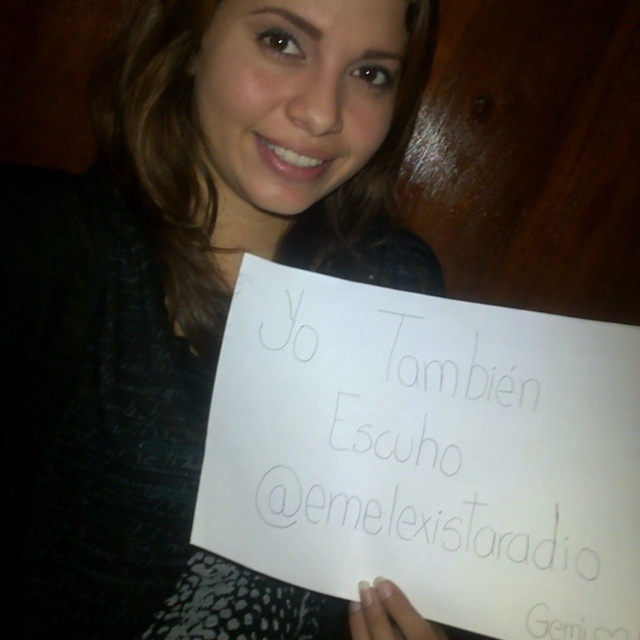
Image resolution: width=640 pixels, height=640 pixels. What do you see at coordinates (188, 301) in the screenshot?
I see `matte black paper at center` at bounding box center [188, 301].

Is matte black paper at center shorter than white paper at center?

No, matte black paper at center is not shorter than white paper at center.

Between point (342, 8) and point (525, 324), which one is positioned behind?

Point (525, 324)

The image size is (640, 640). What are the coordinates of `matte black paper at center` in the screenshot? It's located at (188, 301).